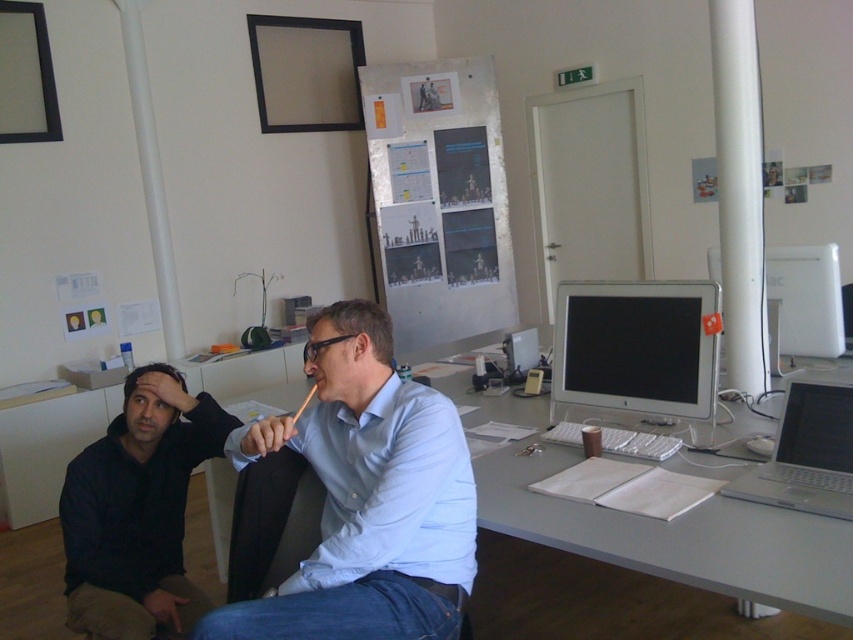
Does dark blue hoodie at lower left appear under silver metallic laptop at right?

Yes.

Between dark blue hoodie at lower left and silver metallic laptop at right, which one has more height?

dark blue hoodie at lower left

Is point (144, 408) less distant than point (773, 480)?

No.

Find the location of a particular element. dark blue hoodie at lower left is located at coordinates (137, 509).

Who is higher up, light blue shirt at center or dark blue hoodie at lower left?

light blue shirt at center is higher up.

Describe the element at coordinates (354, 500) in the screenshot. This screenshot has width=853, height=640. I see `light blue shirt at center` at that location.

Between point (358, 385) and point (204, 397), which one is positioned in front?

Positioned in front is point (358, 385).

At what (x,y) coordinates should I click in order to perform the action: click on light blue shirt at center. Please return your answer as a coordinate pair (x, y). Looking at the image, I should click on (354, 500).

Find the location of `light blue shirt at center`. light blue shirt at center is located at coordinates (354, 500).

Locate an element on the screen. light blue shirt at center is located at coordinates (354, 500).

Identify the location of light blue shirt at center. The image size is (853, 640). (354, 500).